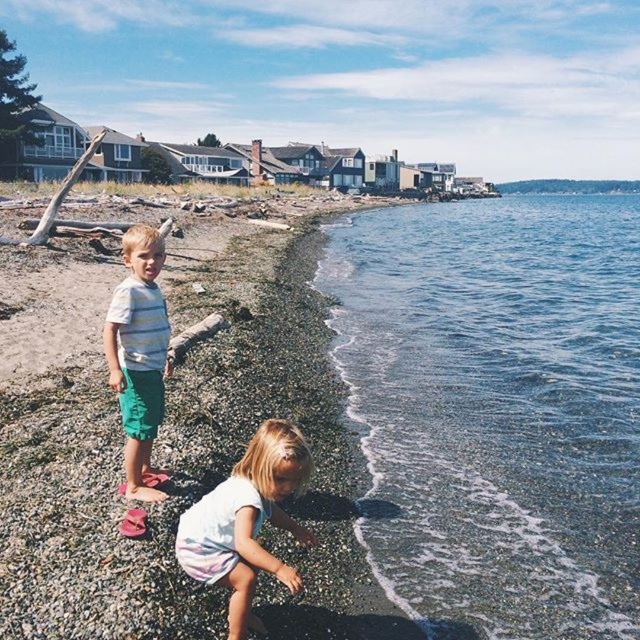
Question: Which point is closer to the camera taking this photo?

Choices:
 (A) (584, 394)
 (B) (116, 301)

Answer: (B)

Question: Is the position of clear water at lower right less distant than that of smooth pebbles at lower left?

Choices:
 (A) yes
 (B) no

Answer: (B)

Question: Which point is closer to the camera?

Choices:
 (A) (244, 630)
 (B) (564, 214)

Answer: (A)

Question: Does smooth pebbles at lower left appear over light pink cotton dress at lower center?

Choices:
 (A) no
 (B) yes

Answer: (B)

Question: From the image, what is the correct spatial relationship of clear water at lower right in relation to light pink cotton dress at lower center?

Choices:
 (A) left
 (B) right

Answer: (B)

Question: Among these points, which one is farthest from the camera?

Choices:
 (A) (132, 397)
 (B) (236, 540)
 (C) (497, 388)

Answer: (C)